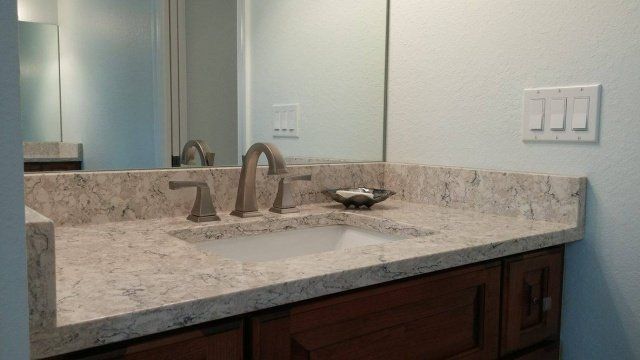
I want to click on sink faucet, so click(x=250, y=187).